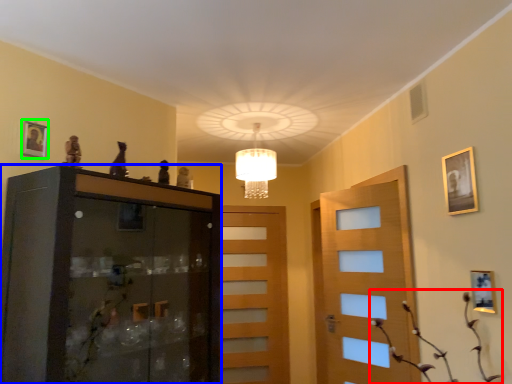
Question: Estimate the real-world distances between objects in this image. Which object is closer to plant (highlighted by a red box), cabinetry (highlighted by a blue box) or picture frame (highlighted by a green box)?

Choices:
 (A) cabinetry
 (B) picture frame

Answer: (A)